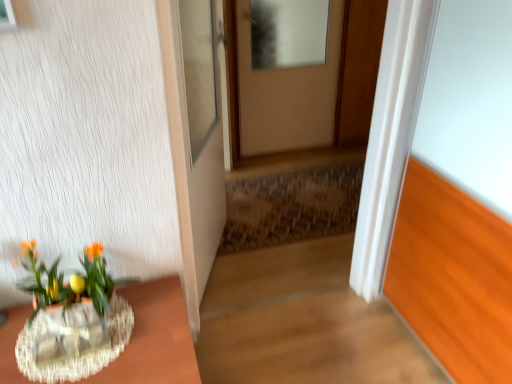
Where is `vacant location below white glossy door at center, which appears as the 2th door when viewed from the back (from a real-world perspective)`? The width and height of the screenshot is (512, 384). vacant location below white glossy door at center, which appears as the 2th door when viewed from the back (from a real-world perspective) is located at coordinates (217, 277).